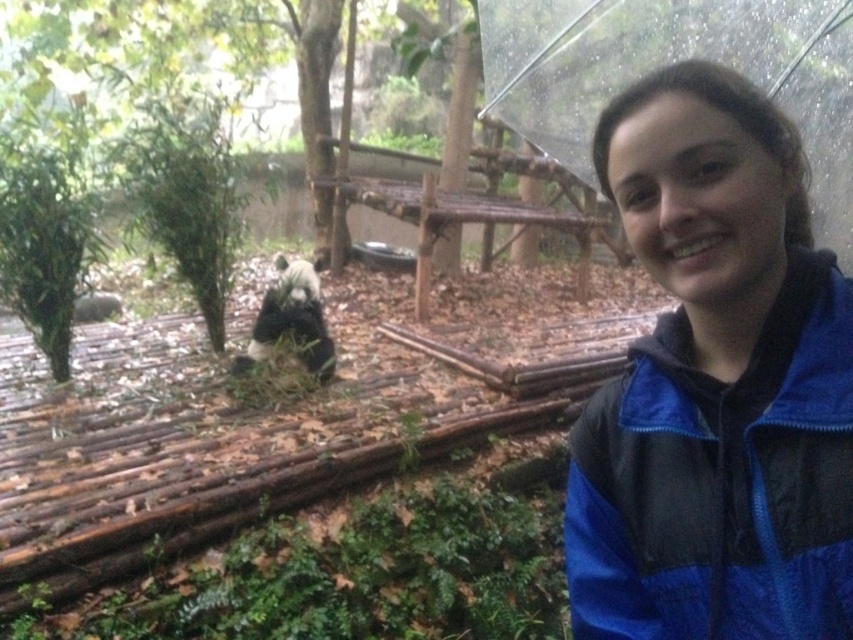
Question: Based on their relative distances, which object is nearer to the blue synthetic jacket at lower right?

Choices:
 (A) transparent plastic umbrella at upper right
 (B) black fur panda at center

Answer: (A)

Question: Can you confirm if blue synthetic jacket at lower right is positioned to the right of black fur panda at center?

Choices:
 (A) no
 (B) yes

Answer: (B)

Question: Which point is closer to the camera?

Choices:
 (A) [753, 12]
 (B) [660, 540]

Answer: (B)

Question: Where is blue synthetic jacket at lower right located in relation to black fur panda at center in the image?

Choices:
 (A) left
 (B) right

Answer: (B)

Question: Which point is farther from the camera taking this photo?

Choices:
 (A) (256, 317)
 (B) (831, 138)

Answer: (A)

Question: Is the position of blue synthetic jacket at lower right more distant than that of black fur panda at center?

Choices:
 (A) yes
 (B) no

Answer: (B)